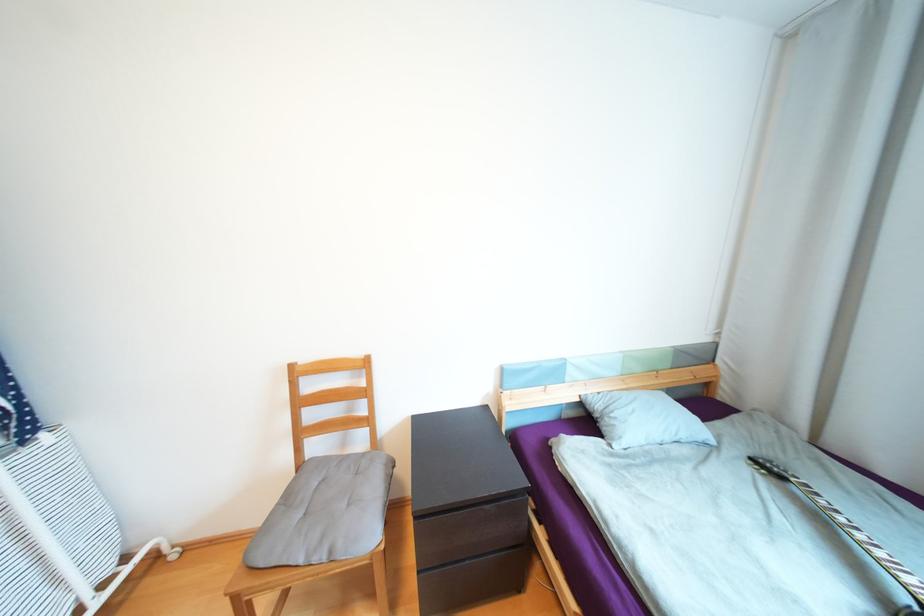
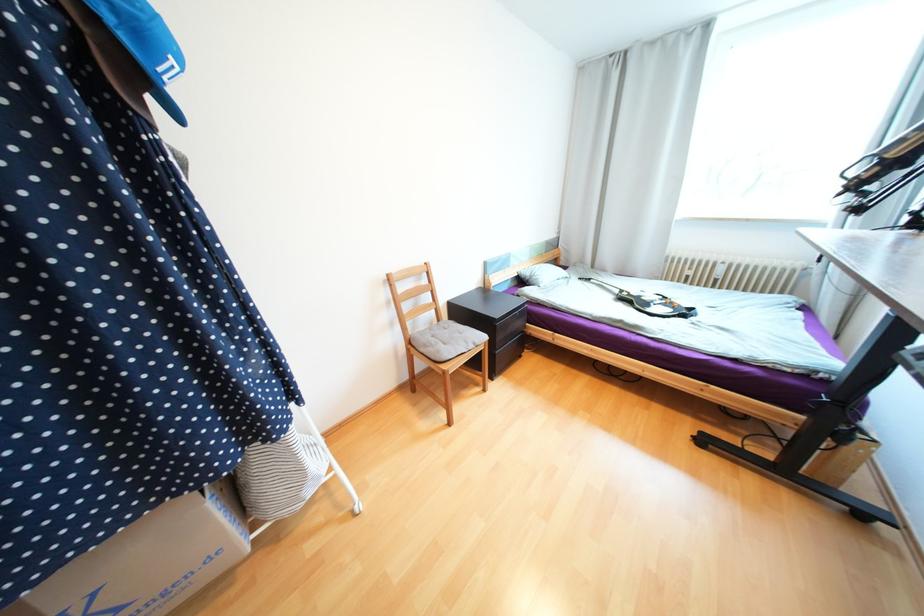
Locate, in the second image, the point that corresponds to the point at 588,392 in the first image.

(524, 270)